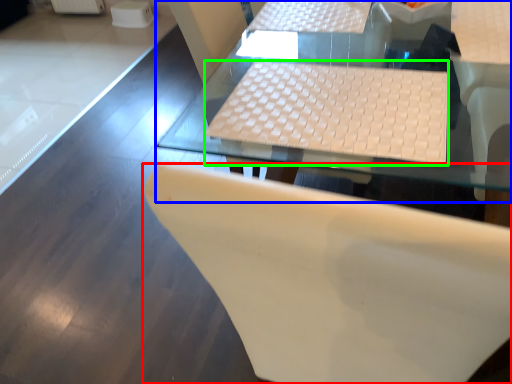
Question: Which object is the closest to the chair (highlighted by a red box)? Choose among these: table (highlighted by a blue box) or laptop keyboard (highlighted by a green box).

Choices:
 (A) table
 (B) laptop keyboard

Answer: (B)